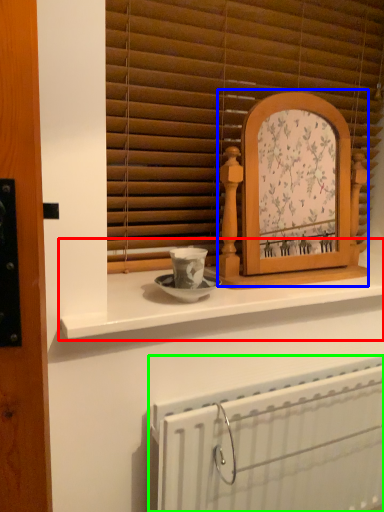
Question: Based on their relative distances, which object is farther from counter (highlighted by a red box)? Choose from picture frame (highlighted by a blue box) and radiator (highlighted by a green box).

Choices:
 (A) picture frame
 (B) radiator

Answer: (B)